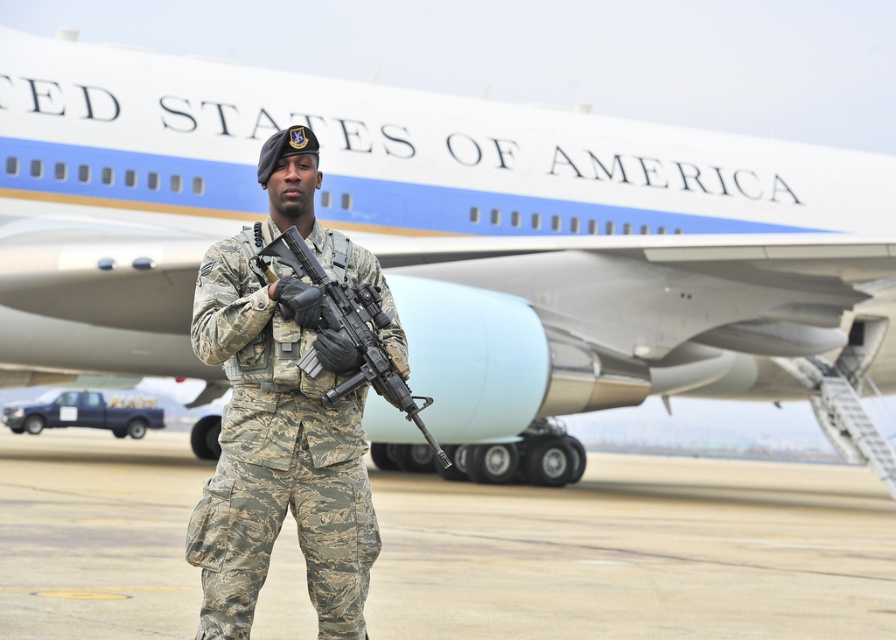
You are a photographer trying to capture a clear shot of the white matte airplane at center and the camouflage uniform at center. Which object should you focus on first if you want to ensure both are in focus without adjusting the camera settings?

The white matte airplane at center is further to the viewer than the camouflage uniform at center, so you should focus on the white matte airplane at center first to ensure both are in focus.

You are a photographer trying to capture the white matte airplane at center and the camouflage pants at center in a single frame. Based on their positions, can you determine which object is closer to the camera?

The white matte airplane at center is positioned over camouflage pants at center, meaning the camouflage pants at center is closer to the camera than the airplane.

You need to determine if the white matte airplane at center can be fully covered by a large tarp that is 10 meters wide. Given that the camouflage uniform at center is 0.5 meters wide, can the airplane be covered?

The white matte airplane at center is larger in width than the camouflage uniform at center, which is 0.5 meters wide. However, without knowing the exact width of the airplane, it is impossible to determine if the 10 meters wide tarp is sufficient to cover it fully.